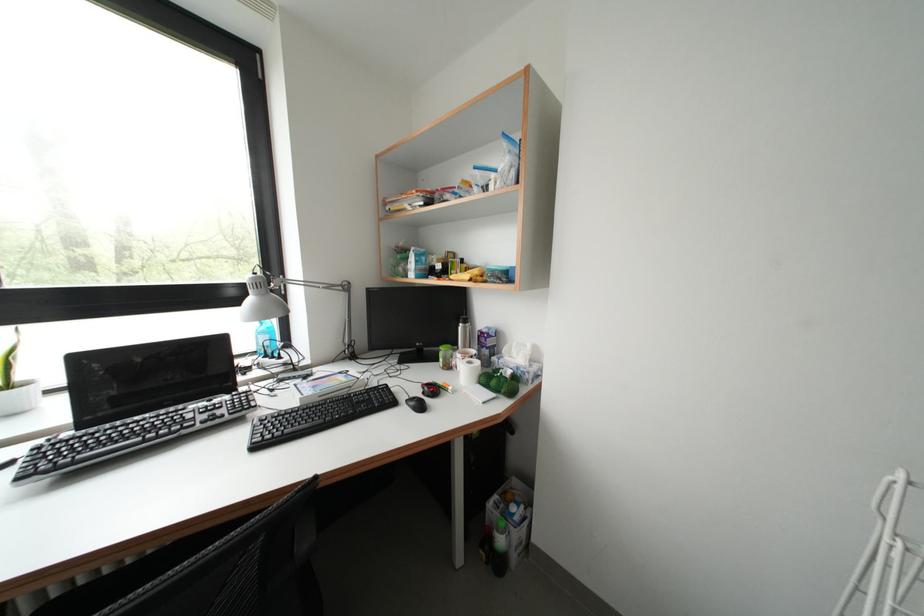
Where is `white paper roll`? white paper roll is located at coordinates (468, 371).